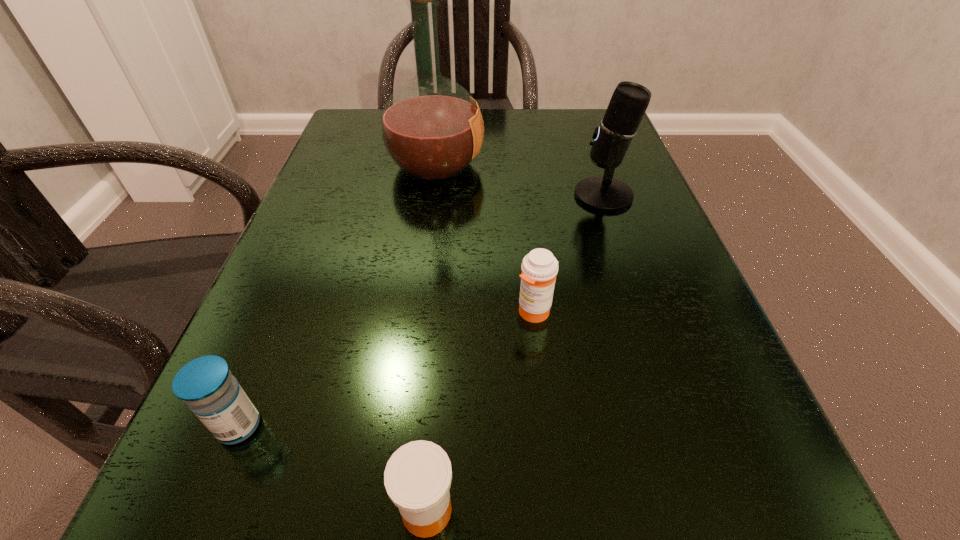
Find the location of a particular element. blank space located on the right of the leftmost object is located at coordinates (530, 426).

This screenshot has height=540, width=960. I want to click on object at the far edge, so click(432, 128).

Locate an element on the screen. The image size is (960, 540). liquor positioned at the left edge is located at coordinates (432, 128).

Image resolution: width=960 pixels, height=540 pixels. Find the location of `medicine positioned at the left edge`. medicine positioned at the left edge is located at coordinates (206, 384).

What are the coordinates of `object present at the right edge` in the screenshot? It's located at (628, 104).

The image size is (960, 540). Identify the location of object located in the far left corner section of the desktop. (432, 128).

Where is `vacant space at the far edge`? Image resolution: width=960 pixels, height=540 pixels. vacant space at the far edge is located at coordinates (534, 123).

In the image, there is a desktop. Where is `vacant space at the left edge`? vacant space at the left edge is located at coordinates [355, 170].

This screenshot has width=960, height=540. Identify the location of free space at the right edge. (661, 237).

What are the coordinates of `blank space at the far right corner` in the screenshot? It's located at (602, 111).